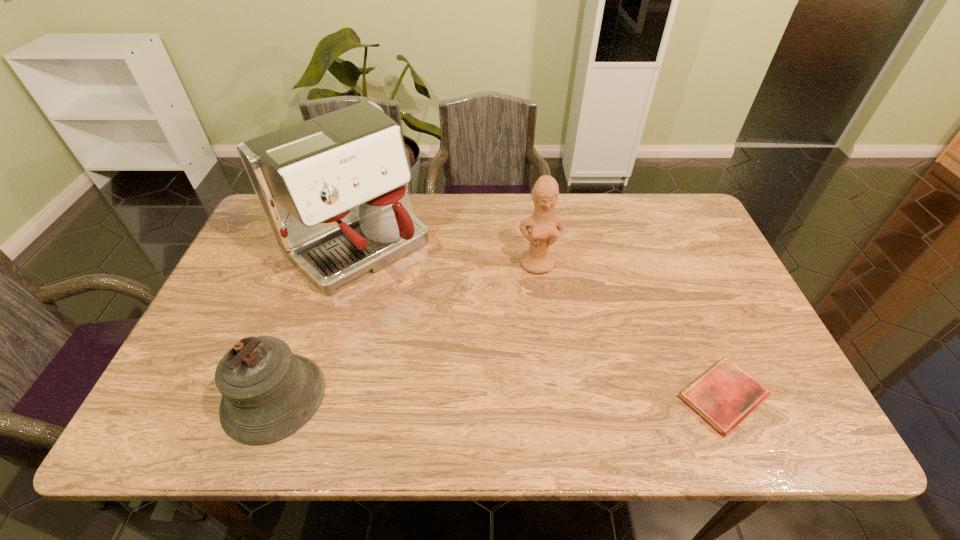
Identify the location of object located in the far left corner section of the desktop. The image size is (960, 540). (332, 189).

Locate an element on the screen. This screenshot has height=540, width=960. object that is at the near left corner is located at coordinates (268, 393).

The width and height of the screenshot is (960, 540). In order to click on object at the near right corner in this screenshot , I will do point(723,396).

Identify the location of blank space at the far edge. (556, 215).

I want to click on free space at the near edge, so click(x=556, y=369).

What are the coordinates of `vacant space at the left edge of the desktop` in the screenshot? It's located at (237, 278).

The height and width of the screenshot is (540, 960). In the image, there is a desktop. What are the coordinates of `vacant space at the right edge` in the screenshot? It's located at (721, 324).

I want to click on free space at the far right corner, so click(701, 238).

Where is `unoccupied area between the second shortest object and the shortest object`? This screenshot has width=960, height=540. unoccupied area between the second shortest object and the shortest object is located at coordinates (498, 396).

This screenshot has height=540, width=960. What are the coordinates of `vacant area that lies between the shortest object and the bell` in the screenshot? It's located at (498, 396).